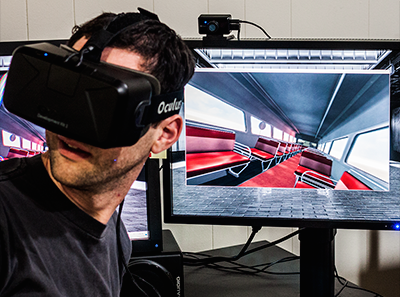
Identify the location of power on light. This screenshot has width=400, height=297. (397, 226), (155, 244).